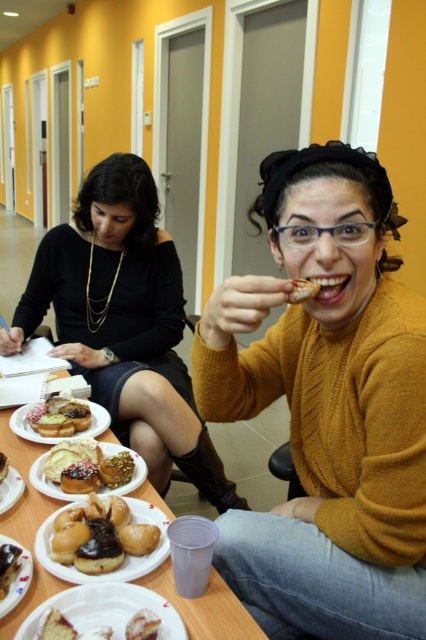
Question: Can you confirm if sprinkled sugar donut at center is positioned below powdered sugar cake at center?

Choices:
 (A) yes
 (B) no

Answer: (B)

Question: Is sprinkled sugar donut at center below powdered sugar cake at center?

Choices:
 (A) no
 (B) yes

Answer: (A)

Question: Which point appears farthest from the camera in this image?

Choices:
 (A) (348, 246)
 (B) (14, 554)
 (C) (137, 612)
 (D) (57, 440)

Answer: (D)

Question: Among these points, which one is farthest from the camera?

Choices:
 (A) (149, 632)
 (B) (143, 621)
 (C) (291, 292)
 (D) (134, 586)

Answer: (D)

Question: Which point is closer to the camera?

Choices:
 (A) (5, 577)
 (B) (92, 582)
 (C) (28, 580)

Answer: (B)

Question: Does mustard sweater at center appear on the right side of glazed sugar donut at center?

Choices:
 (A) yes
 (B) no

Answer: (A)